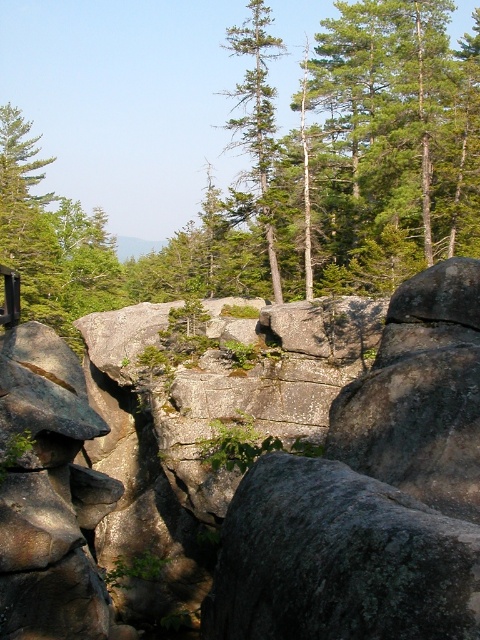
You are a hiker navigating through this rugged landscape and want to identify the tallest green matte tree between the green matte tree at upper left and the green matte tree at upper center. Which one should you look towards?

The green matte tree at upper center is taller than the green matte tree at upper left, so you should look towards the green matte tree at upper center.

You are standing at the base of the rocky outcrops in this rugged landscape and notice two points marked in the scene. One is at coordinate point (56, 310) and the other at point (254, 19). Which of these points is closer to your current position?

Point (56, 310) is closer to your current position because it is further to the viewer than point (254, 19).

You are standing at point (x=51, y=240) in this rugged landscape. What object is located exactly at your current position?

At point (x=51, y=240) lies green matte tree at upper left.